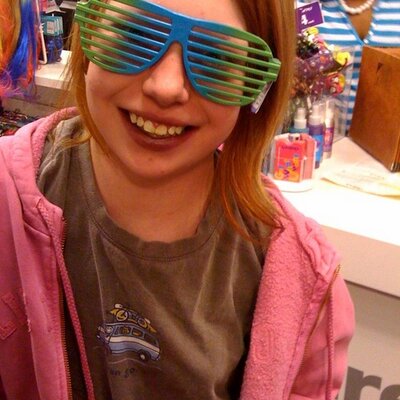
The height and width of the screenshot is (400, 400). What are the coordinates of `bottle` in the screenshot? It's located at (330, 128), (317, 129), (306, 130).